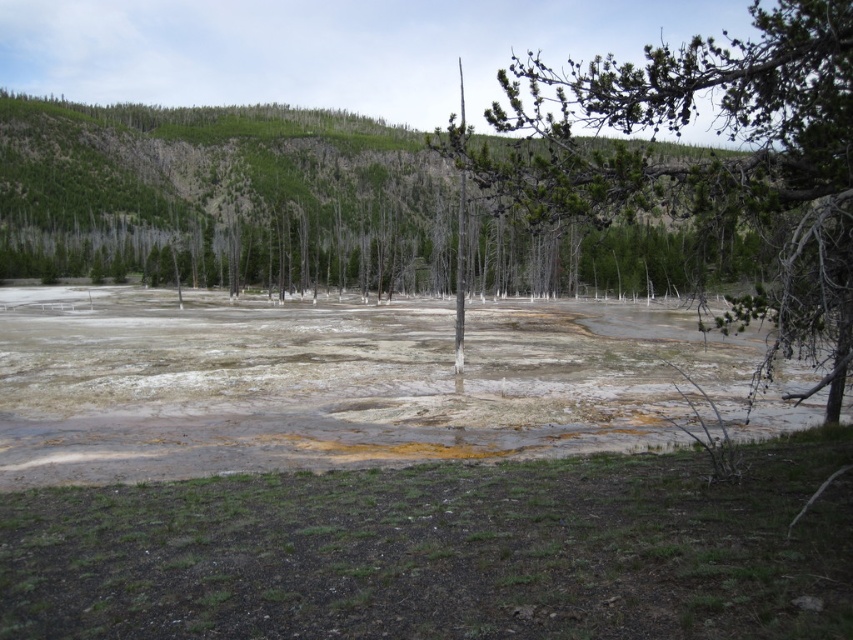
Based on the photo, can you confirm if yellowish sedimentary water at center is positioned above green leafy tree at center?

Incorrect, yellowish sedimentary water at center is not positioned above green leafy tree at center.

From the picture: Can you confirm if yellowish sedimentary water at center is positioned to the left of green leafy tree at center?

Yes, yellowish sedimentary water at center is to the left of green leafy tree at center.

Who is more forward, (341, 316) or (843, 106)?

Point (843, 106)

At what (x,y) coordinates should I click in order to perform the action: click on yellowish sedimentary water at center. Please return your answer as a coordinate pair (x, y). The image size is (853, 640). Looking at the image, I should click on (344, 384).

How distant is green forested hillside at upper center from green leafy tree at center?

green forested hillside at upper center and green leafy tree at center are 86.58 meters apart.

Is green forested hillside at upper center above green leafy tree at center?

Actually, green forested hillside at upper center is below green leafy tree at center.

Which is behind, point (705, 150) or point (730, 64)?

The point (705, 150) is behind.

Locate an element on the screen. The width and height of the screenshot is (853, 640). green forested hillside at upper center is located at coordinates coord(222,196).

Which of these two, yellowish sedimentary water at center or green forested hillside at upper center, stands shorter?

yellowish sedimentary water at center is shorter.

Consider the image. Is yellowish sedimentary water at center taller than green forested hillside at upper center?

Incorrect, yellowish sedimentary water at center's height is not larger of green forested hillside at upper center's.

The width and height of the screenshot is (853, 640). What do you see at coordinates (344, 384) in the screenshot?
I see `yellowish sedimentary water at center` at bounding box center [344, 384].

Where is `yellowish sedimentary water at center`? yellowish sedimentary water at center is located at coordinates (344, 384).